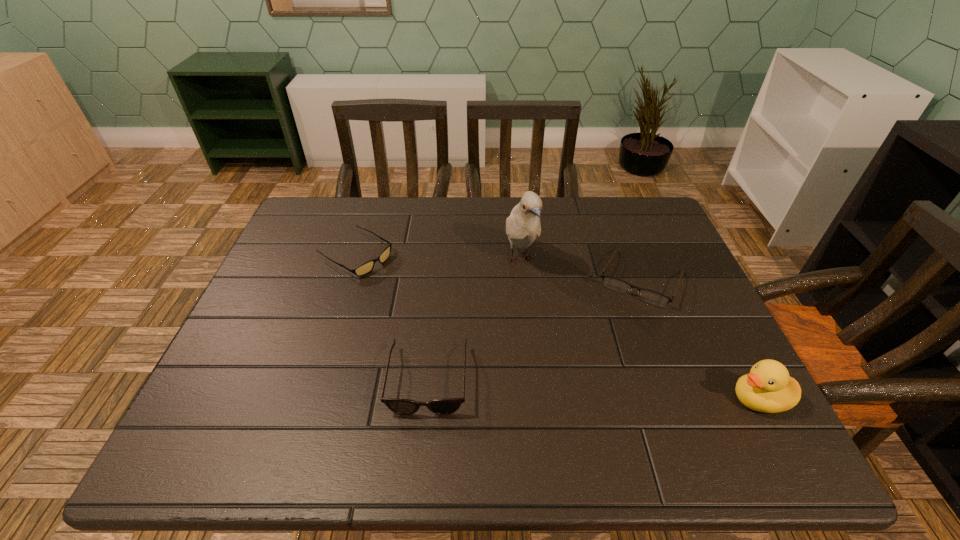
Where is `bird that is at the far edge`? This screenshot has height=540, width=960. bird that is at the far edge is located at coordinates (523, 225).

You are a GUI agent. You are given a task and a screenshot of the screen. Output one action in this format:
    pyautogui.click(x=<x>, y=<y>)
    Task: Click on the sunglasses located at the far edge
    Image resolution: width=960 pixels, height=540 pixels.
    Given the screenshot: What is the action you would take?
    pyautogui.click(x=365, y=268)

Image resolution: width=960 pixels, height=540 pixels. Find the location of `sunglasses at the near edge`. sunglasses at the near edge is located at coordinates (399, 406).

The width and height of the screenshot is (960, 540). Find the location of `duckling located in the near edge section of the desktop`. duckling located in the near edge section of the desktop is located at coordinates (768, 388).

You are a GUI agent. You are given a task and a screenshot of the screen. Output one action in this format:
    pyautogui.click(x=<x>, y=<y>)
    Task: Click on the object that is at the left edge
    This screenshot has height=540, width=960.
    Given the screenshot: What is the action you would take?
    pyautogui.click(x=365, y=268)

Identify the location of duckling positioned at the right edge. (768, 388).

This screenshot has width=960, height=540. Identify the location of spectacles located at the right edge. (652, 297).

You are a GUI agent. You are given a task and a screenshot of the screen. Output one action in this format:
    pyautogui.click(x=<x>, y=<y>)
    Task: Click on the object present at the far left corner
    The width and height of the screenshot is (960, 540).
    Given the screenshot: What is the action you would take?
    pyautogui.click(x=365, y=268)

Where is `object that is at the near right corner`? object that is at the near right corner is located at coordinates (768, 388).

In the image, there is a desktop. Identify the location of free space at the far edge. Image resolution: width=960 pixels, height=540 pixels. (450, 220).